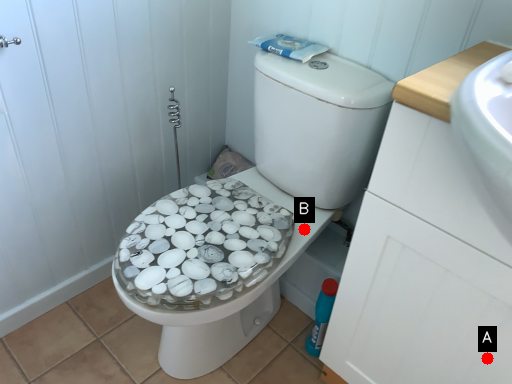
Question: Two points are circled on the image, labeled by A and B beside each circle. Which point appears closest to the camera in this image?

Choices:
 (A) A is closer
 (B) B is closer

Answer: (A)